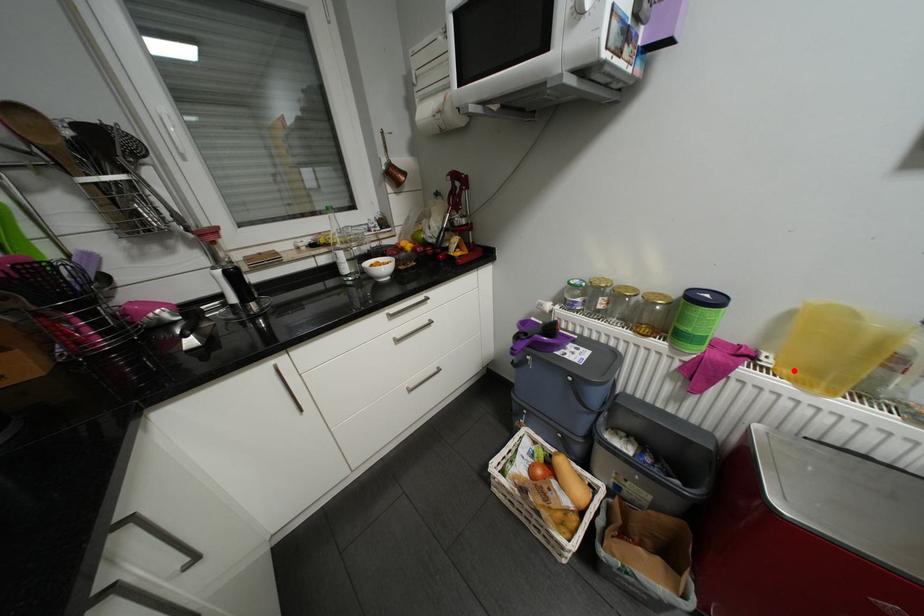
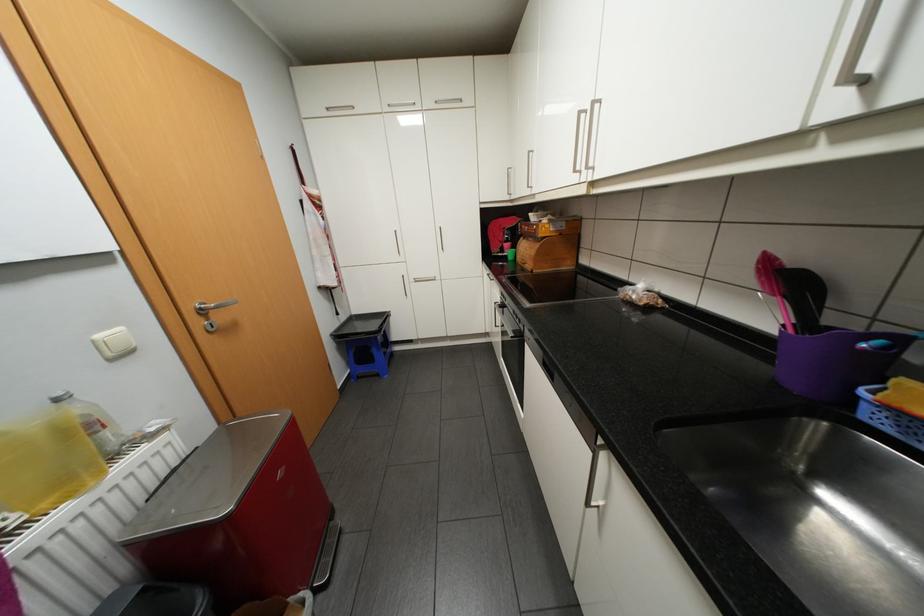
In the second image, find the point that corresponds to the highlighted location in the first image.

(53, 504)